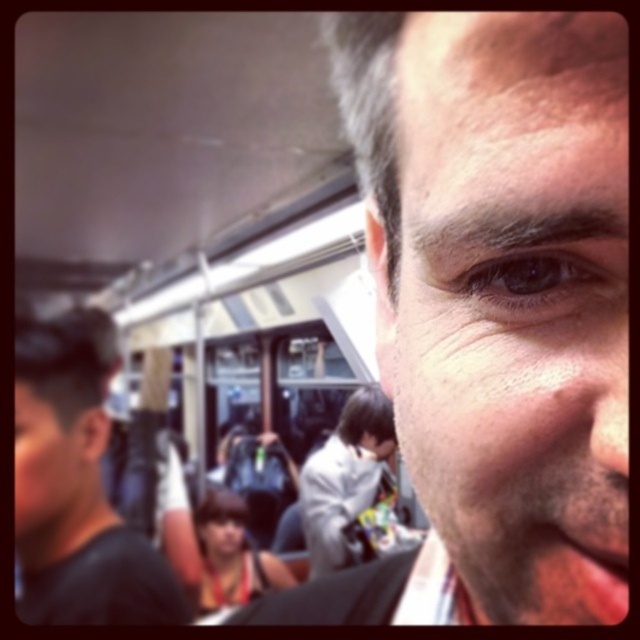
You are a photographer trying to capture a clear shot of the smooth skin face at center without including the black matte shirt at left in the frame. Based on their positions, is this possible?

The black matte shirt at left is in front of the smooth skin face at center, so it would block the view. To capture the smooth skin face at center without the black matte shirt at left, you would need to reposition yourself or wait until the black matte shirt at left moves out of the way.

You are a photographer trying to capture a candid shot of the scene. You notice the black matte shirt at left and the matte black face at lower left are too close. Can you estimate if there is enough space between them to focus on one subject without blurring the other?

The black matte shirt at left is only 1.82 inches away from the matte black face at lower left. This close proximity may cause both subjects to be in the same focal plane, leading to potential blurring if the camera settings aren